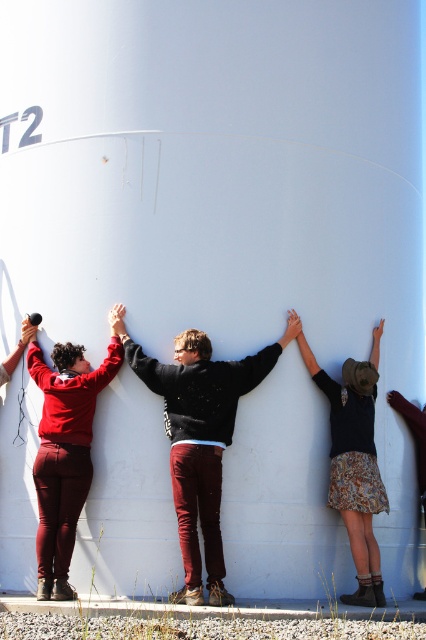
Based on the photo, is matte red pants at left wider than patterned skirt at center?

Correct, the width of matte red pants at left exceeds that of patterned skirt at center.

Does matte red pants at left appear on the left side of patterned skirt at center?

Correct, you'll find matte red pants at left to the left of patterned skirt at center.

You are a GUI agent. You are given a task and a screenshot of the screen. Output one action in this format:
    pyautogui.click(x=<x>, y=<y>)
    Task: Click on the matte red pants at left
    The image size is (426, 640).
    Given the screenshot: What is the action you would take?
    pyautogui.click(x=65, y=452)

This screenshot has width=426, height=640. Identify the location of matte red pants at left. (65, 452).

The image size is (426, 640). Describe the element at coordinates (199, 429) in the screenshot. I see `dark gray sweater at center` at that location.

Measure the distance between point (213, 508) and camera.

Point (213, 508) and camera are 9.56 meters apart.

Find the location of a particular element. dark gray sweater at center is located at coordinates (199, 429).

I want to click on dark gray sweater at center, so click(x=199, y=429).

Does dark gray sweater at center come in front of matte red pants at left?

Yes, it is.

Who is taller, dark gray sweater at center or matte red pants at left?

Standing taller between the two is dark gray sweater at center.

The width and height of the screenshot is (426, 640). What do you see at coordinates (199, 429) in the screenshot?
I see `dark gray sweater at center` at bounding box center [199, 429].

Find the location of `dark gray sweater at center`. dark gray sweater at center is located at coordinates (199, 429).